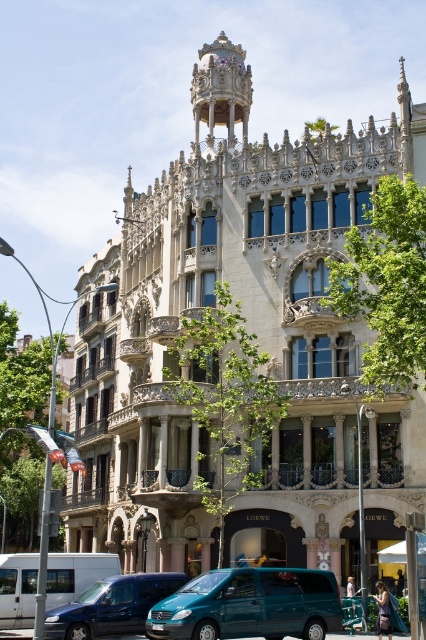
You are standing in front of the grand building and want to take a photo. You notice two points on the building marked as point 1 and point 2. If point 1 is at coordinates (x=259, y=588) and point 2 is at (x=62, y=625), which point is closer to your camera lens?

Point 1 at coordinates (x=259, y=588) is closer to the camera lens than point 2 at (x=62, y=625).